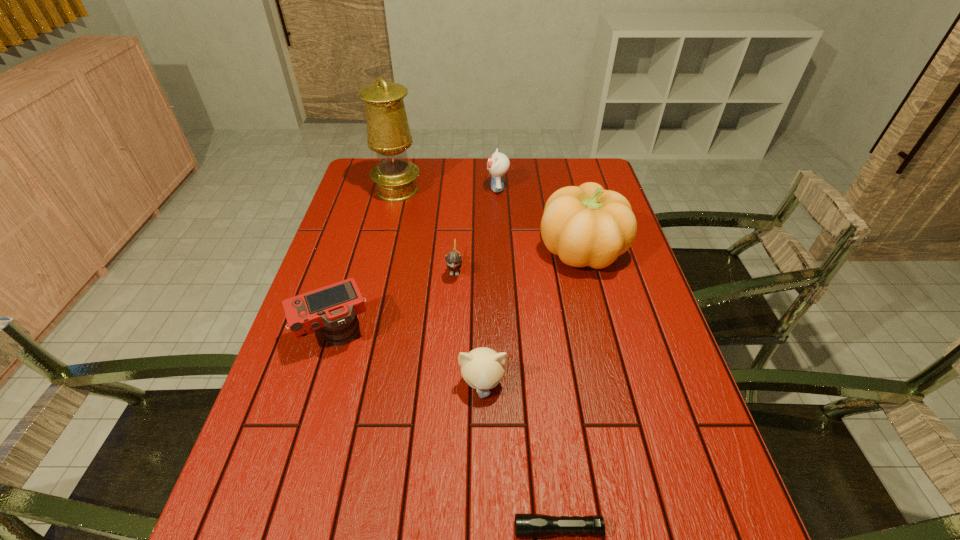
In order to click on the sixth closest object to the second tallest kitten in this screenshot , I will do `click(498, 164)`.

Identify which object is the second nearest to the pumpkin. Please provide its 2D coordinates. Your answer should be formatted as a tuple, i.e. [(x, y)], where the tuple contains the x and y coordinates of a point satisfying the conditions above.

[(453, 259)]

Image resolution: width=960 pixels, height=540 pixels. In order to click on kitten that stands as the closest to the second nearest object in this screenshot , I will do `click(453, 259)`.

Identify which kitten is located as the second nearest to the nearest kitten. Please provide its 2D coordinates. Your answer should be formatted as a tuple, i.e. [(x, y)], where the tuple contains the x and y coordinates of a point satisfying the conditions above.

[(498, 164)]

Find the location of a particular element. Image resolution: width=960 pixels, height=540 pixels. vacant space that satisfies the following two spatial constraints: 1. on the front-facing side of the tallest kitten; 2. on the front-facing side of the leftmost kitten is located at coordinates tap(501, 268).

I want to click on free spot that satisfies the following two spatial constraints: 1. on the front-facing side of the tallest kitten; 2. on the right side of the sixth shortest object, so click(x=500, y=249).

In order to click on free location that satisfies the following two spatial constraints: 1. on the front-facing side of the tallest kitten; 2. on the left side of the pumpkin in this screenshot , I will do `click(500, 249)`.